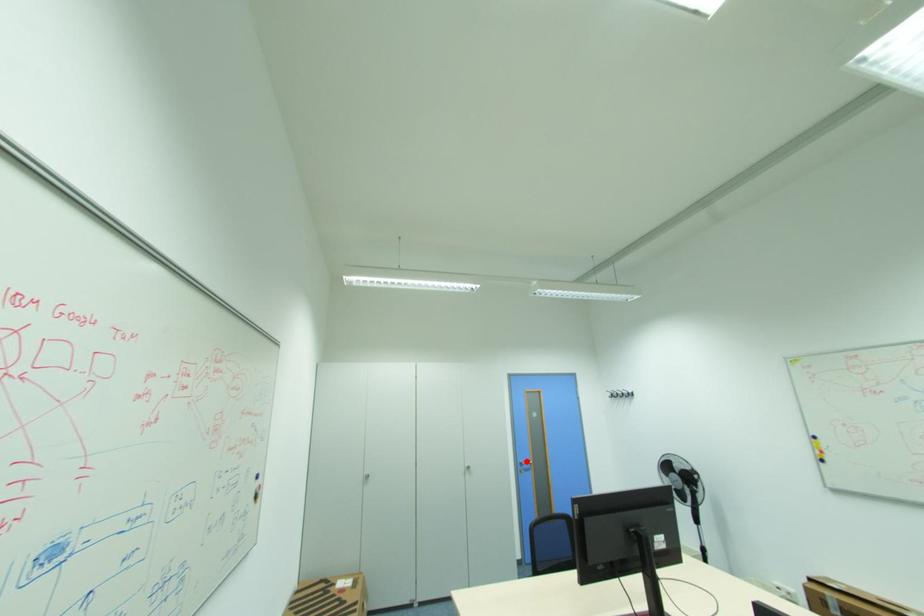
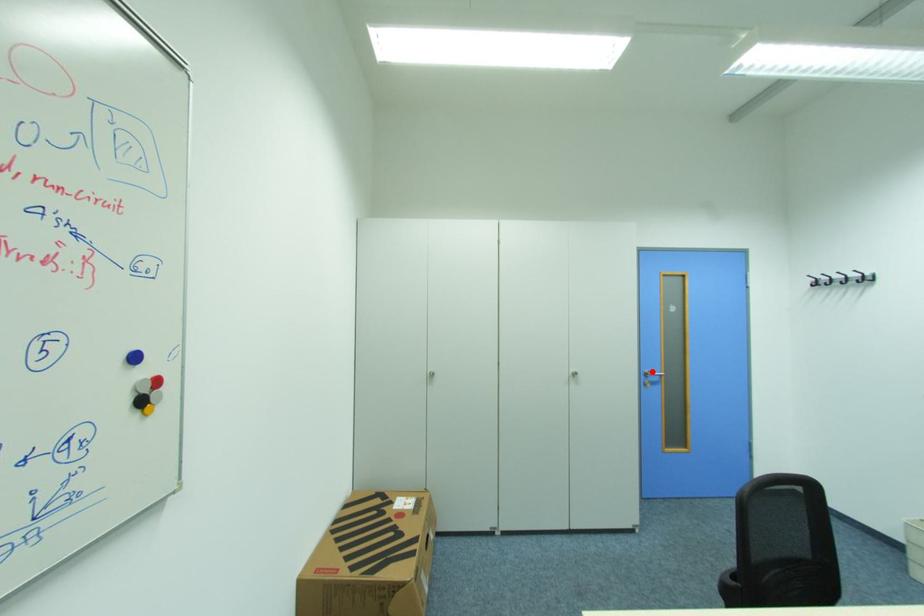
I am providing you with two images of the same scene from different viewpoints. A red point is marked on the first image and another point is marked on the second image. Is the marked point in image1 the same physical position as the marked point in image2?

Yes